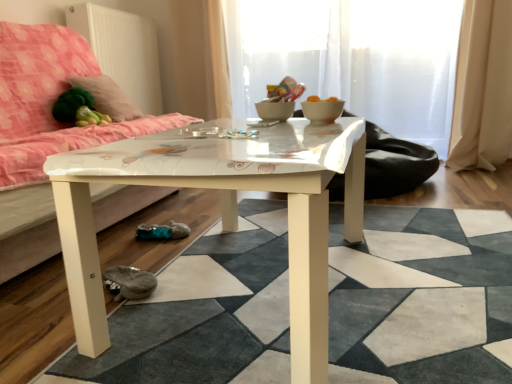
Question: From the image's perspective, is matte pink fabric couch at left on top of beige fabric curtain at right?

Choices:
 (A) no
 (B) yes

Answer: (A)

Question: Is the depth of matte pink fabric couch at left greater than that of beige fabric curtain at right?

Choices:
 (A) yes
 (B) no

Answer: (B)

Question: Is the position of matte pink fabric couch at left less distant than that of beige fabric curtain at right?

Choices:
 (A) no
 (B) yes

Answer: (B)

Question: From a real-world perspective, does matte pink fabric couch at left stand above beige fabric curtain at right?

Choices:
 (A) no
 (B) yes

Answer: (A)

Question: Is matte pink fabric couch at left positioned with its back to beige fabric curtain at right?

Choices:
 (A) yes
 (B) no

Answer: (B)

Question: Is matte pink fabric couch at left smaller than beige fabric curtain at right?

Choices:
 (A) no
 (B) yes

Answer: (A)

Question: From the image's perspective, is white glossy bowl at center below white glossy coffee table at center?

Choices:
 (A) yes
 (B) no

Answer: (B)

Question: Considering the relative sizes of white glossy bowl at center and white glossy coffee table at center in the image provided, is white glossy bowl at center bigger than white glossy coffee table at center?

Choices:
 (A) no
 (B) yes

Answer: (A)

Question: Does white glossy bowl at center have a smaller size compared to white glossy coffee table at center?

Choices:
 (A) yes
 (B) no

Answer: (A)

Question: Is white glossy bowl at center facing away from white glossy coffee table at center?

Choices:
 (A) yes
 (B) no

Answer: (B)

Question: Does white glossy bowl at center appear on the right side of white glossy coffee table at center?

Choices:
 (A) no
 (B) yes

Answer: (B)

Question: Is white glossy bowl at center at the left side of white glossy coffee table at center?

Choices:
 (A) no
 (B) yes

Answer: (A)

Question: From a real-world perspective, is transparent glass door at upper center, which appears as the 1th glass door when viewed from the back, located higher than fluffy pink pillow at upper left?

Choices:
 (A) yes
 (B) no

Answer: (A)